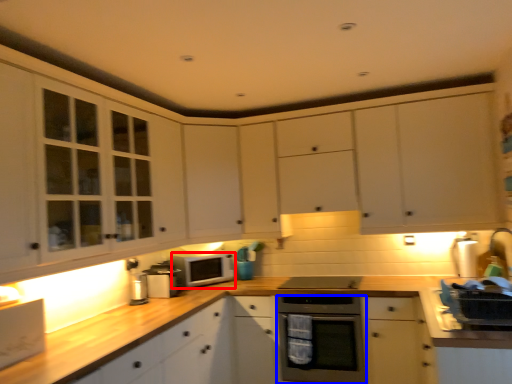
Question: Which point is closer to the camera, microwave oven (highlighted by a red box) or home appliance (highlighted by a blue box)?

Choices:
 (A) microwave oven
 (B) home appliance

Answer: (B)